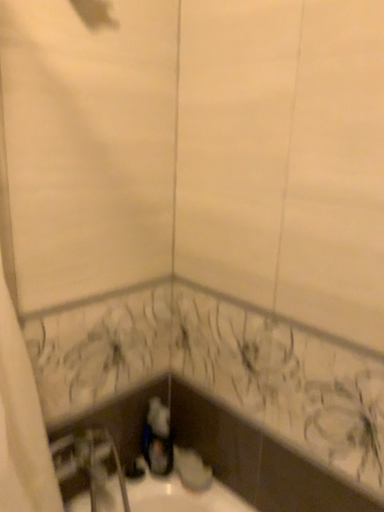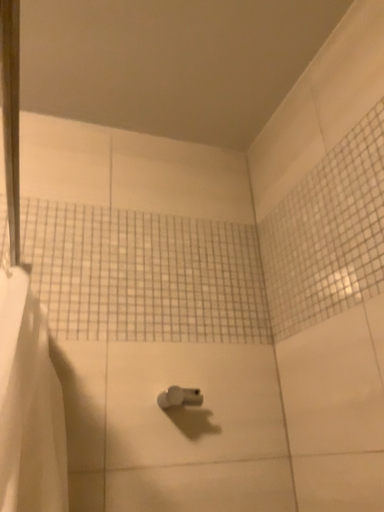
Question: How did the camera likely rotate when shooting the video?

Choices:
 (A) rotated right
 (B) rotated left

Answer: (B)